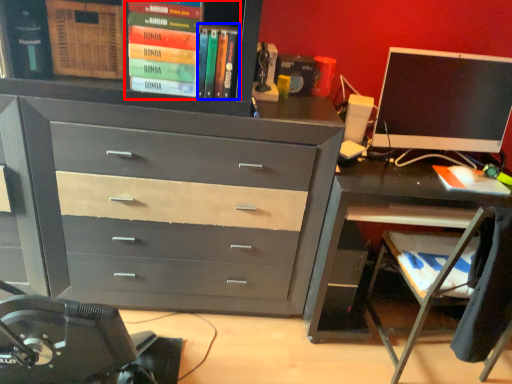
Question: Which of the following is the farthest to the observer, book (highlighted by a red box) or book (highlighted by a blue box)?

Choices:
 (A) book
 (B) book

Answer: (B)